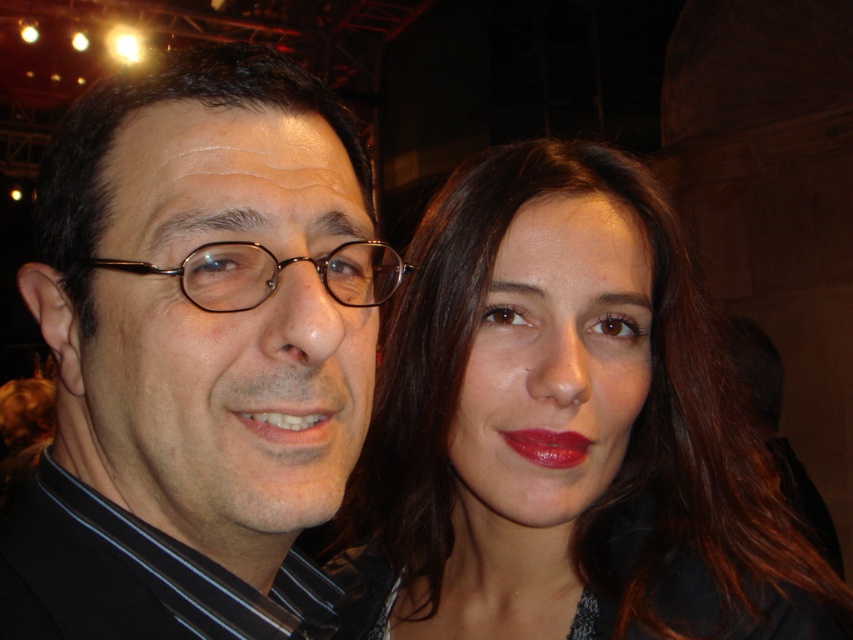
Question: Is smooth brown hair at center to the left of matte red lipstick at center from the viewer's perspective?

Choices:
 (A) yes
 (B) no

Answer: (B)

Question: Can you confirm if matte black glasses at left is positioned above shiny red lipstick at center?

Choices:
 (A) no
 (B) yes

Answer: (B)

Question: Which of the following is the farthest from the observer?

Choices:
 (A) matte red lipstick at center
 (B) matte black glasses at left
 (C) shiny red lipstick at center
 (D) metallic round glasses at center

Answer: (C)

Question: Can you confirm if matte black glasses at left is positioned to the right of smooth brown hair at center?

Choices:
 (A) no
 (B) yes

Answer: (A)

Question: Which object is the farthest from the matte black glasses at left?

Choices:
 (A) matte red lipstick at center
 (B) smooth brown hair at center
 (C) metallic round glasses at center

Answer: (B)

Question: Which object is the farthest from the matte red lipstick at center?

Choices:
 (A) smooth brown hair at center
 (B) matte black glasses at left
 (C) metallic round glasses at center

Answer: (A)